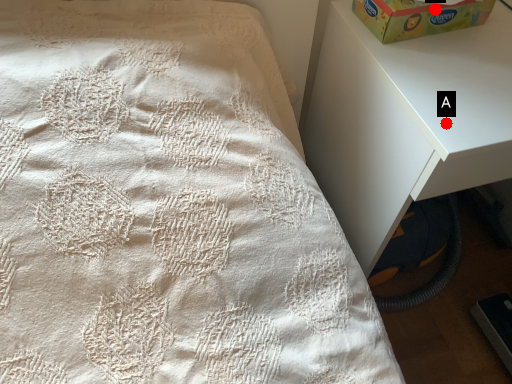
Question: Two points are circled on the image, labeled by A and B beside each circle. Which point is closer to the camera?

Choices:
 (A) A is closer
 (B) B is closer

Answer: (A)